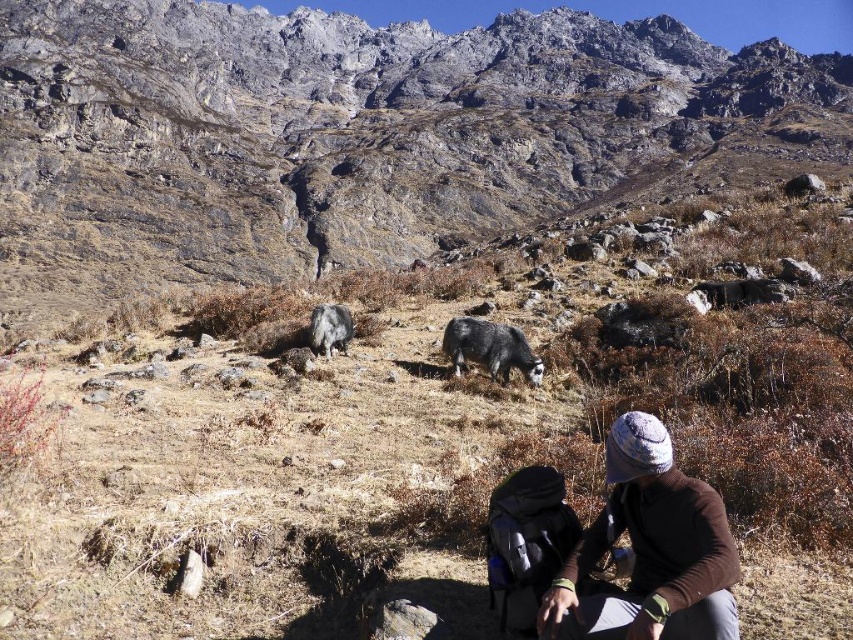
Measure the distance between gray rocky mountain at center and gray woolen yak at center.

gray rocky mountain at center is 180.10 meters from gray woolen yak at center.

Does gray rocky mountain at center have a smaller size compared to gray woolen yak at center?

No, gray rocky mountain at center is not smaller than gray woolen yak at center.

Image resolution: width=853 pixels, height=640 pixels. In order to click on gray rocky mountain at center in this screenshot , I will do `click(355, 132)`.

At what (x,y) coordinates should I click in order to perform the action: click on gray rocky mountain at center. Please return your answer as a coordinate pair (x, y). Looking at the image, I should click on (355, 132).

Can you confirm if gray woolen yak at center is positioned above fuzzy gray goat at center?

No.

Who is more distant from viewer, (462,358) or (310,333)?

Positioned behind is point (310,333).

At what (x,y) coordinates should I click in order to perform the action: click on gray woolen yak at center. Please return your answer as a coordinate pair (x, y). The height and width of the screenshot is (640, 853). Looking at the image, I should click on (490, 348).

Does brown woolen hat at lower right have a greater width compared to gray woolen yak at center?

No.

Does point (703, 588) lie in front of point (482, 348)?

Yes, point (703, 588) is in front of point (482, 348).

In order to click on brown woolen hat at lower right in this screenshot , I will do `click(650, 548)`.